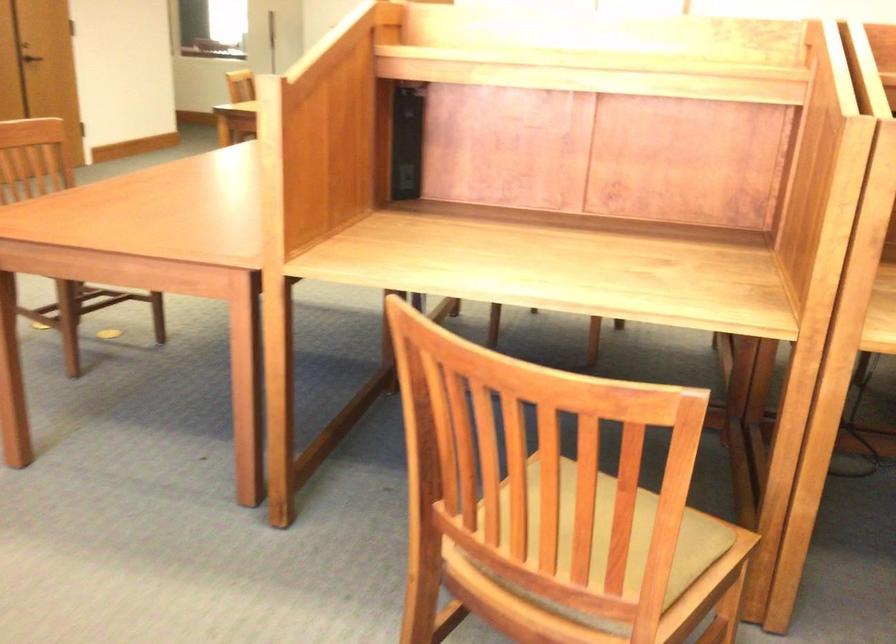
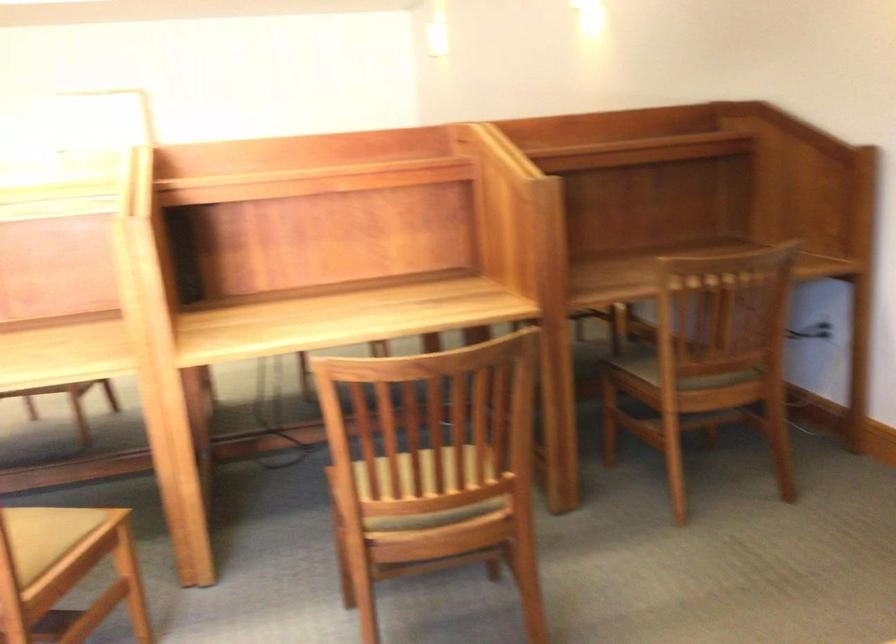
The point at (x=693, y=551) is marked in the first image. Where is the corresponding point in the second image?

(62, 536)